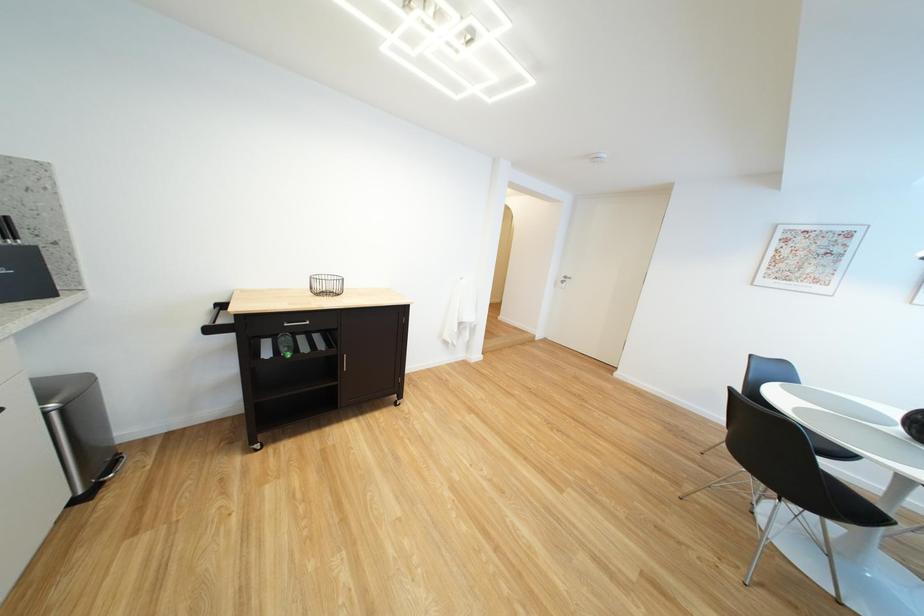
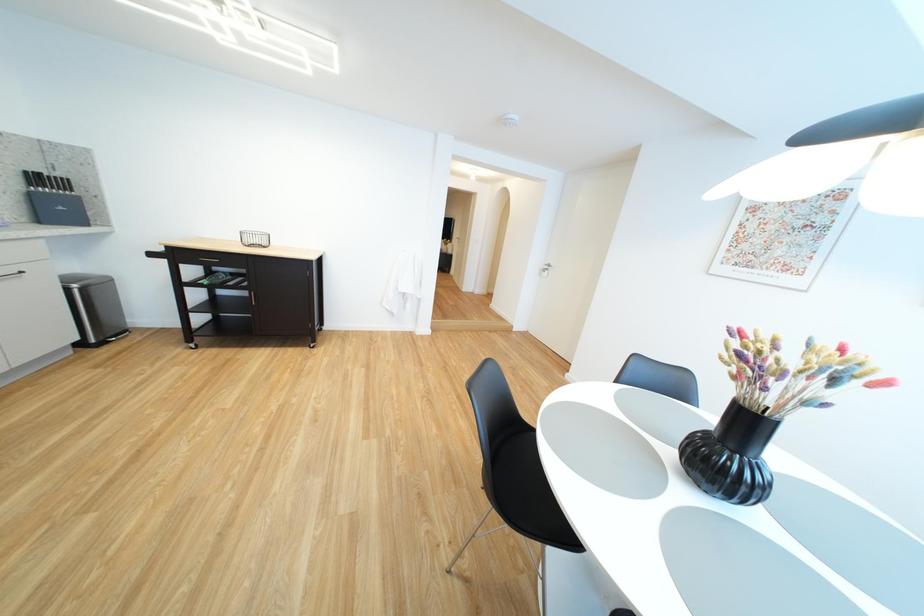
Question: What movement of the cameraman would produce the second image?

Choices:
 (A) Left
 (B) Right
 (C) Forward
 (D) Backward

Answer: (B)